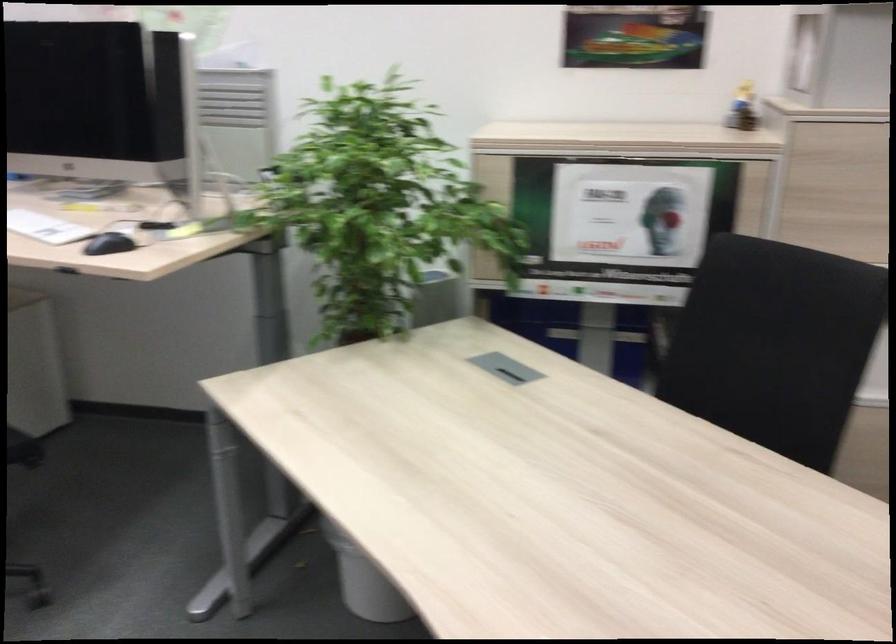
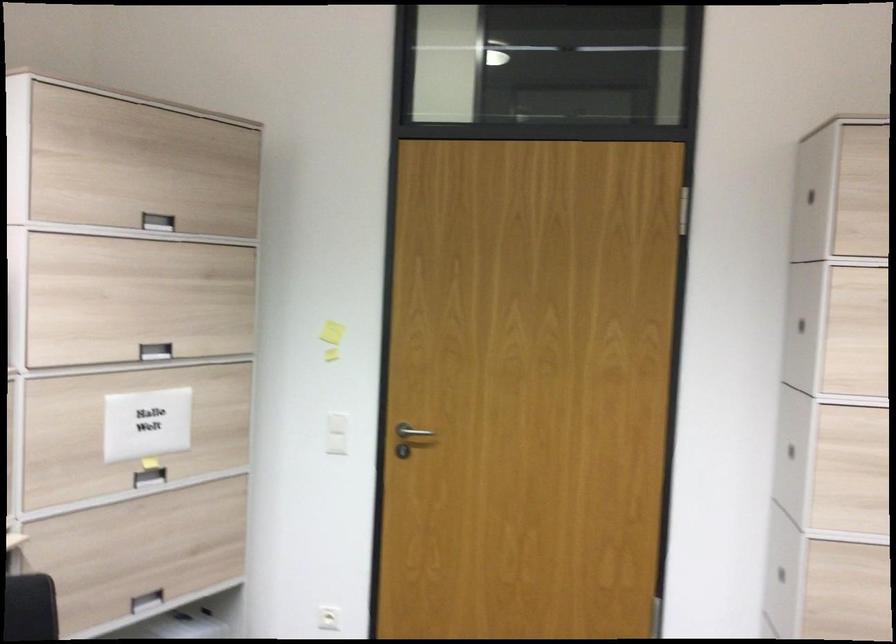
Question: The images are taken continuously from a first-person perspective. In which direction is your viewpoint rotating?

Choices:
 (A) Left
 (B) Right
 (C) Up
 (D) Down

Answer: (B)